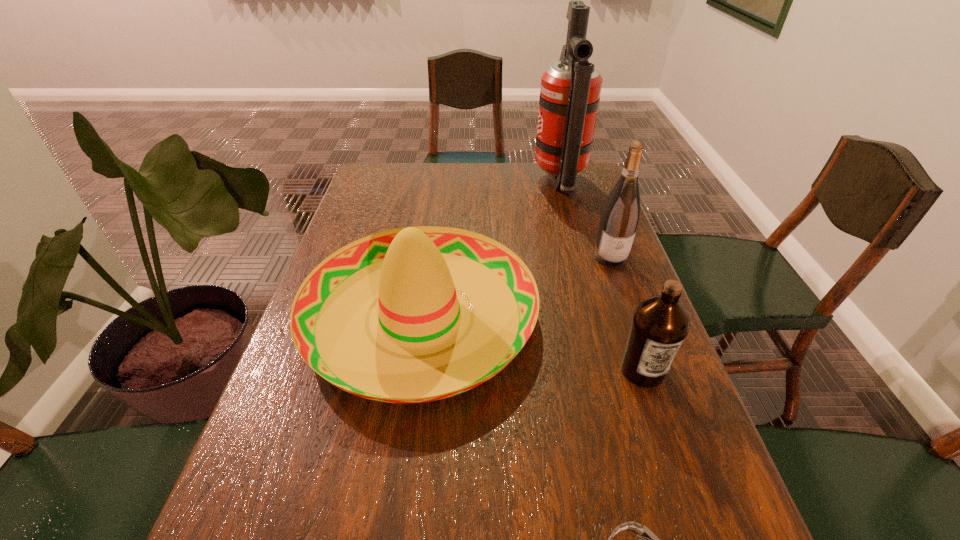
This screenshot has width=960, height=540. In the image, there is a desktop. Find the location of `vacant area at the far right corner`. vacant area at the far right corner is located at coordinates (590, 190).

Locate an element on the screen. vacant point located between the tallest object and the olive oil is located at coordinates (601, 276).

I want to click on unoccupied area between the olive oil and the wine bottle, so click(627, 314).

Find the location of a particular element. This screenshot has width=960, height=540. object that stands as the closest to the nearest object is located at coordinates 421,342.

At what (x,y) coordinates should I click in order to perform the action: click on object that is the closest to the second tallest object. Please return your answer as a coordinate pair (x, y). The width and height of the screenshot is (960, 540). Looking at the image, I should click on (421, 342).